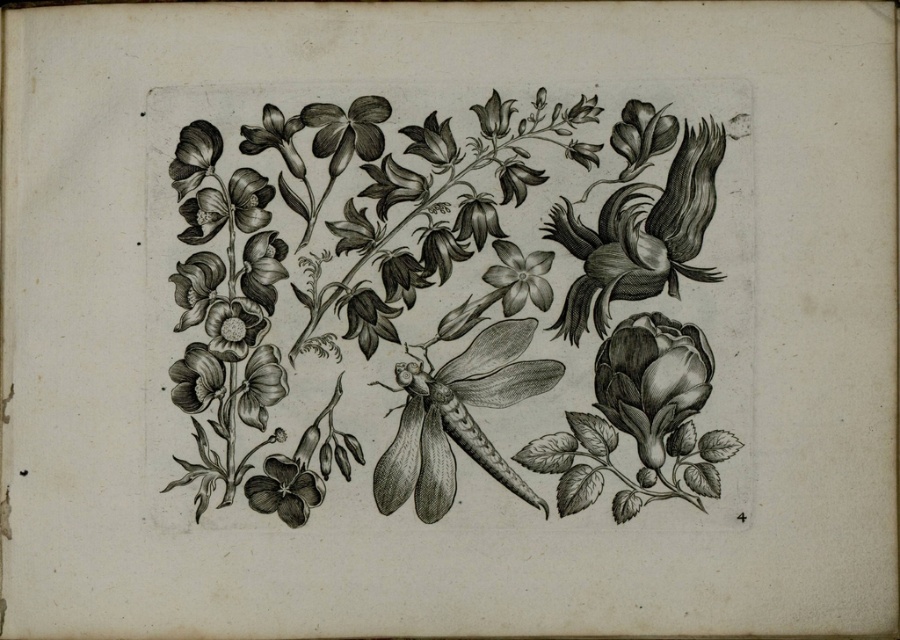
Which is above, smooth black dragonfly at center or smooth paper flower at center?

smooth paper flower at center

Is smooth black dragonfly at center wider than smooth paper flower at center?

Correct, the width of smooth black dragonfly at center exceeds that of smooth paper flower at center.

Between point (491, 381) and point (504, 259), which one is positioned behind?

Positioned behind is point (504, 259).

Where is `smooth black dragonfly at center`? Image resolution: width=900 pixels, height=640 pixels. smooth black dragonfly at center is located at coordinates (459, 419).

Which is below, smooth black dragonfly at center or smooth black flower at bottom left?

smooth black flower at bottom left is lower down.

Based on the photo, does smooth black dragonfly at center appear over smooth black flower at bottom left?

Yes.

This screenshot has width=900, height=640. I want to click on smooth black dragonfly at center, so click(459, 419).

At what (x,y) coordinates should I click in order to perform the action: click on smooth black dragonfly at center. Please return your answer as a coordinate pair (x, y). Looking at the image, I should click on (459, 419).

Does smooth black rose at right come in front of smooth black flower at bottom left?

That is True.

Does smooth black rose at right appear on the left side of smooth black flower at bottom left?

No, smooth black rose at right is not to the left of smooth black flower at bottom left.

Which is in front, point (676, 444) or point (252, 484)?

Point (676, 444)

Where is `smooth black rose at right`? smooth black rose at right is located at coordinates (652, 381).